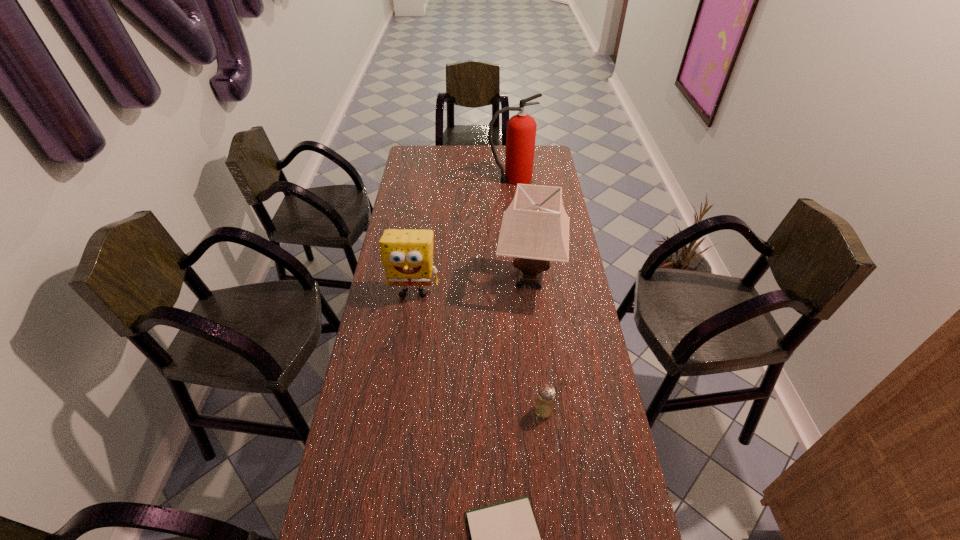
At what (x,y) coordinates should I click in order to perform the action: click on the farthest object. Please return your answer as a coordinate pair (x, y). The height and width of the screenshot is (540, 960). Looking at the image, I should click on (521, 128).

This screenshot has width=960, height=540. In order to click on lampshade in this screenshot , I will do `click(535, 228)`.

The width and height of the screenshot is (960, 540). I want to click on the leftmost object, so tap(407, 255).

Find the location of a particular element. This screenshot has height=540, width=960. the third shortest object is located at coordinates (407, 255).

Where is `the second nearest object`? Image resolution: width=960 pixels, height=540 pixels. the second nearest object is located at coordinates (544, 407).

Locate an element on the screen. This screenshot has height=540, width=960. saltshaker is located at coordinates (544, 407).

This screenshot has width=960, height=540. I want to click on vacant space positioned 0.090m on the handle side of the fire extinguisher, so click(x=554, y=179).

Identify the location of vacant region located on the back of the lampshade. The width and height of the screenshot is (960, 540). (525, 237).

Where is `vacant space located on the face of the leftmost object`? This screenshot has height=540, width=960. vacant space located on the face of the leftmost object is located at coordinates (397, 402).

Identify the location of vacant area located on the left of the saltshaker. (397, 410).